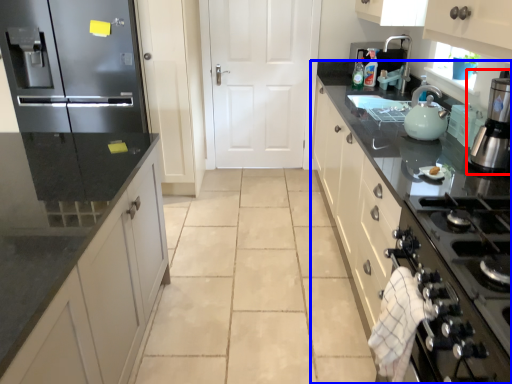
Question: Among these objects, which one is farthest to the camera, home appliance (highlighted by a red box) or countertop (highlighted by a blue box)?

Choices:
 (A) home appliance
 (B) countertop

Answer: (A)